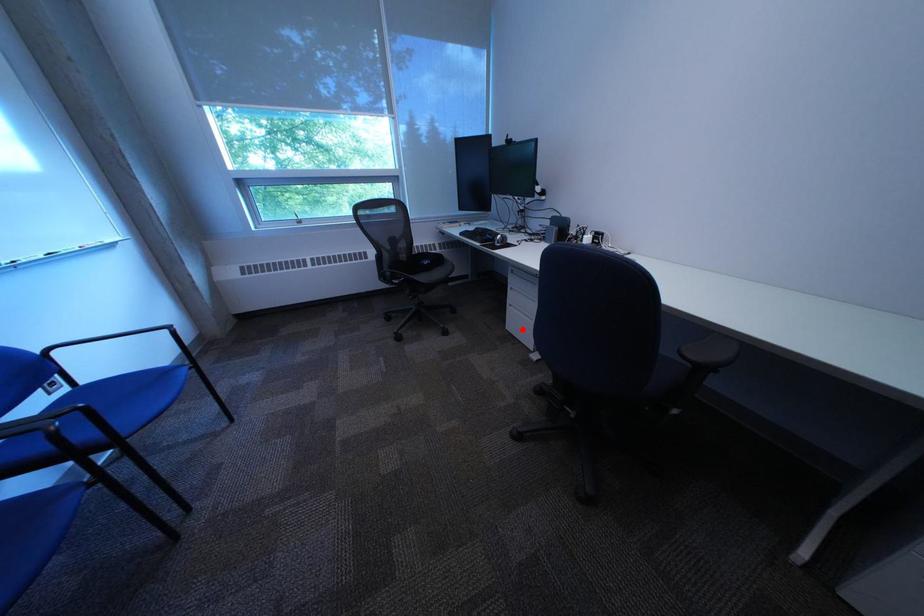
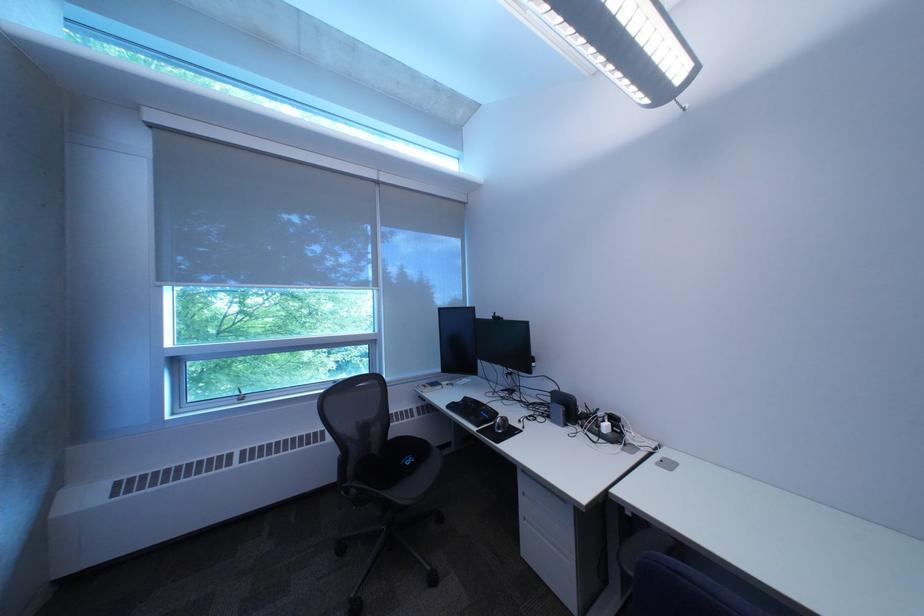
Where in the second image is the point corresponding to the highlighted location from the first image?

(539, 556)